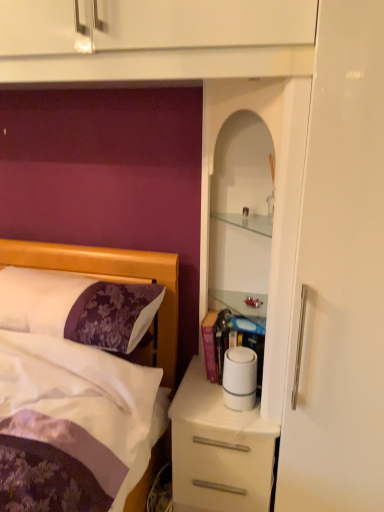
Locate an element on the screen. This screenshot has height=512, width=384. vacant space in front of white matte toilet paper at center is located at coordinates (241, 423).